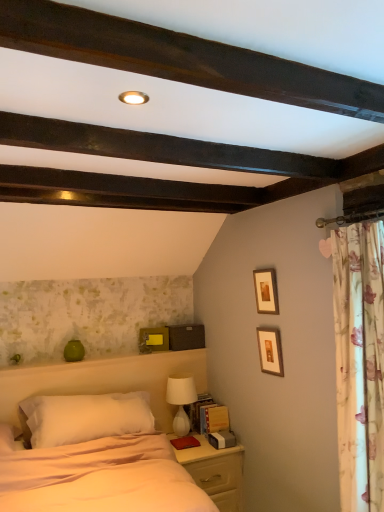
Identify the location of white glossy table lamp at lower center. The height and width of the screenshot is (512, 384). (181, 400).

Describe the element at coordinates (270, 351) in the screenshot. I see `wooden picture frame at upper right, which is counted as the 3th picture frame, starting from the left` at that location.

The width and height of the screenshot is (384, 512). What are the coordinates of `white soft bed at center` in the screenshot? It's located at (95, 460).

At what (x,y) coordinates should I click in order to perform the action: click on wooden picture frame at upper center, which ranks as the 2th picture frame in back-to-front order. Please return your answer as a coordinate pair (x, y). This screenshot has width=384, height=512. Looking at the image, I should click on (266, 291).

Identify the location of table lamp below the yellow matte picture frame at upper center, the third picture frame in the front-to-back sequence (from the image's perspective). (181, 400).

Is white glossy table lamp at lower center surrounded by yellow matte picture frame at upper center, the 1th picture frame from the bottom?

No, white glossy table lamp at lower center is not a part of yellow matte picture frame at upper center, the 1th picture frame from the bottom.

Considering the points (141, 337) and (177, 416), which point is behind, point (141, 337) or point (177, 416)?

Positioned behind is point (141, 337).

Considering the relative positions of white glossy table lamp at lower center and wooden picture frame at upper center, acting as the third picture frame starting from the bottom, in the image provided, is white glossy table lamp at lower center to the right of wooden picture frame at upper center, acting as the third picture frame starting from the bottom, from the viewer's perspective?

No.

In the scene shown: Is white glossy table lamp at lower center positioned with its back to wooden picture frame at upper center, marked as the 1th picture frame in a top-to-bottom arrangement?

No.

From the image's perspective, would you say white glossy table lamp at lower center is shown under wooden picture frame at upper center, the second picture frame from the front?

Indeed, from the image's perspective, white glossy table lamp at lower center is shown beneath wooden picture frame at upper center, the second picture frame from the front.

Considering the relative sizes of white glossy table lamp at lower center and wooden picture frame at upper center, the second picture frame from the front, in the image provided, is white glossy table lamp at lower center wider than wooden picture frame at upper center, the second picture frame from the front,?

Yes.

Looking at this image, is white soft bed at center to the left of wooden picture frame at upper center, acting as the third picture frame starting from the bottom, from the viewer's perspective?

Yes, white soft bed at center is to the left of wooden picture frame at upper center, acting as the third picture frame starting from the bottom.

Based on their sizes in the image, would you say white soft bed at center is bigger or smaller than wooden picture frame at upper center, acting as the third picture frame starting from the bottom?

In the image, white soft bed at center appears to be larger than wooden picture frame at upper center, acting as the third picture frame starting from the bottom.

From a real-world perspective, is white soft bed at center positioned over wooden picture frame at upper center, which ranks as the 2th picture frame in back-to-front order, based on gravity?

No, from a real-world perspective, white soft bed at center is not above wooden picture frame at upper center, which ranks as the 2th picture frame in back-to-front order.

Can you confirm if white soft bed at center is thinner than wooden picture frame at upper center, positioned as the 2th picture frame in left-to-right order?

Incorrect, the width of white soft bed at center is not less than that of wooden picture frame at upper center, positioned as the 2th picture frame in left-to-right order.

In the scene shown: Can you confirm if wooden picture frame at upper right, positioned as the 3th picture frame in back-to-front order, is bigger than floral fabric curtain at right?

Actually, wooden picture frame at upper right, positioned as the 3th picture frame in back-to-front order, might be smaller than floral fabric curtain at right.

Does wooden picture frame at upper right, placed as the first picture frame when sorted from front to back, turn towards floral fabric curtain at right?

No, wooden picture frame at upper right, placed as the first picture frame when sorted from front to back, does not turn towards floral fabric curtain at right.

Is wooden picture frame at upper right, the 2th picture frame when ordered from top to bottom, in front of or behind floral fabric curtain at right in the image?

Visually, wooden picture frame at upper right, the 2th picture frame when ordered from top to bottom, is located behind floral fabric curtain at right.

Would you say white soft pillow at center is a long distance from wooden picture frame at upper center, acting as the third picture frame starting from the bottom?

Yes, white soft pillow at center and wooden picture frame at upper center, acting as the third picture frame starting from the bottom, are quite far apart.

Between white soft pillow at center and wooden picture frame at upper center, acting as the third picture frame starting from the bottom, which one has more height?

With more height is white soft pillow at center.

Which object is more forward, white soft pillow at center or wooden picture frame at upper center, marked as the 1th picture frame in a top-to-bottom arrangement?

white soft pillow at center is more forward.

Is white soft pillow at center facing away from wooden picture frame at upper center, positioned as the 2th picture frame in right-to-left order?

No, wooden picture frame at upper center, positioned as the 2th picture frame in right-to-left order, is not at the back of white soft pillow at center.

In terms of size, does white soft bed at center appear bigger or smaller than wooden picture frame at upper right, positioned as the 3th picture frame in back-to-front order?

Clearly, white soft bed at center is larger in size than wooden picture frame at upper right, positioned as the 3th picture frame in back-to-front order.

At what (x,y) coordinates should I click in order to perform the action: click on bed on the left of wooden picture frame at upper right, placed as the first picture frame when sorted from front to back. Please return your answer as a coordinate pair (x, y). The image size is (384, 512). Looking at the image, I should click on (95, 460).

From the image's perspective, which object appears higher, white soft bed at center or wooden picture frame at upper right, the 2th picture frame when ordered from top to bottom?

wooden picture frame at upper right, the 2th picture frame when ordered from top to bottom.

Considering the sizes of objects wooden picture frame at upper right, positioned as the 3th picture frame in back-to-front order, and white glossy table lamp at lower center in the image provided, who is smaller, wooden picture frame at upper right, positioned as the 3th picture frame in back-to-front order, or white glossy table lamp at lower center?

wooden picture frame at upper right, positioned as the 3th picture frame in back-to-front order, is smaller.

Is point (273, 359) closer to viewer compared to point (173, 380)?

Yes, it is in front of point (173, 380).

Consider the image. From the image's perspective, is wooden picture frame at upper right, which ranks as the 2th picture frame in bottom-to-top order, located above or below white glossy table lamp at lower center?

wooden picture frame at upper right, which ranks as the 2th picture frame in bottom-to-top order, is situated higher than white glossy table lamp at lower center in the image.

From a real-world perspective, which picture frame is the 2nd one above the white glossy table lamp at lower center? Please provide its 2D coordinates.

[(153, 339)]

What are the coordinates of `table lamp on the left of wooden picture frame at upper center, marked as the 1th picture frame in a top-to-bottom arrangement` in the screenshot? It's located at click(x=181, y=400).

Looking at the image, which one is located further to wooden picture frame at upper right, which is counted as the 3th picture frame, starting from the left, white glossy table lamp at lower center or white soft pillow at center?

white soft pillow at center lies further to wooden picture frame at upper right, which is counted as the 3th picture frame, starting from the left, than the other object.

Based on their spatial positions, is white glossy table lamp at lower center or light wood nightstand at lower right further from yellow matte picture frame at upper center, which is the 3th picture frame in top-to-bottom order?

light wood nightstand at lower right is further to yellow matte picture frame at upper center, which is the 3th picture frame in top-to-bottom order.

Looking at the image, which one is located further to white soft pillow at center, wooden picture frame at upper right, placed as the first picture frame when sorted from front to back, or wooden picture frame at upper center, acting as the third picture frame starting from the bottom?

Among the two, wooden picture frame at upper center, acting as the third picture frame starting from the bottom, is located further to white soft pillow at center.

Based on their spatial positions, is white soft bed at center or wooden picture frame at upper right, placed as the first picture frame when sorted from front to back, closer to white soft pillow at center?

white soft bed at center lies closer to white soft pillow at center than the other object.

From the image, which object appears to be farther from yellow matte picture frame at upper center, the third picture frame in the front-to-back sequence, light wood nightstand at lower right or white soft bed at center?

white soft bed at center lies further to yellow matte picture frame at upper center, the third picture frame in the front-to-back sequence, than the other object.

When comparing their distances from floral fabric curtain at right, does white glossy table lamp at lower center or yellow matte picture frame at upper center, which is the 3th picture frame in top-to-bottom order, seem closer?

white glossy table lamp at lower center lies closer to floral fabric curtain at right than the other object.

Consider the image. When comparing their distances from floral fabric curtain at right, does wooden picture frame at upper center, positioned as the 2th picture frame in left-to-right order, or white glossy table lamp at lower center seem closer?

wooden picture frame at upper center, positioned as the 2th picture frame in left-to-right order, lies closer to floral fabric curtain at right than the other object.

Estimate the real-world distances between objects in this image. Which object is further from wooden picture frame at upper center, the second picture frame from the front, floral fabric curtain at right or white glossy table lamp at lower center?

white glossy table lamp at lower center lies further to wooden picture frame at upper center, the second picture frame from the front, than the other object.

Where is `pillow positioned between white soft bed at center and wooden picture frame at upper center, marked as the 1th picture frame in a top-to-bottom arrangement, from near to far`? Image resolution: width=384 pixels, height=512 pixels. pillow positioned between white soft bed at center and wooden picture frame at upper center, marked as the 1th picture frame in a top-to-bottom arrangement, from near to far is located at coordinates (84, 417).

Find the location of `table lamp between white soft pillow at center and yellow matte picture frame at upper center, which is the 3th picture frame in top-to-bottom order, from front to back`. table lamp between white soft pillow at center and yellow matte picture frame at upper center, which is the 3th picture frame in top-to-bottom order, from front to back is located at coordinates (181, 400).

The width and height of the screenshot is (384, 512). I want to click on pillow between floral fabric curtain at right and yellow matte picture frame at upper center, the third picture frame in the front-to-back sequence, in the front-back direction, so [x=84, y=417].

Identify the location of pillow between white soft bed at center and wooden picture frame at upper right, which is counted as the 3th picture frame, starting from the left, from front to back. (84, 417).